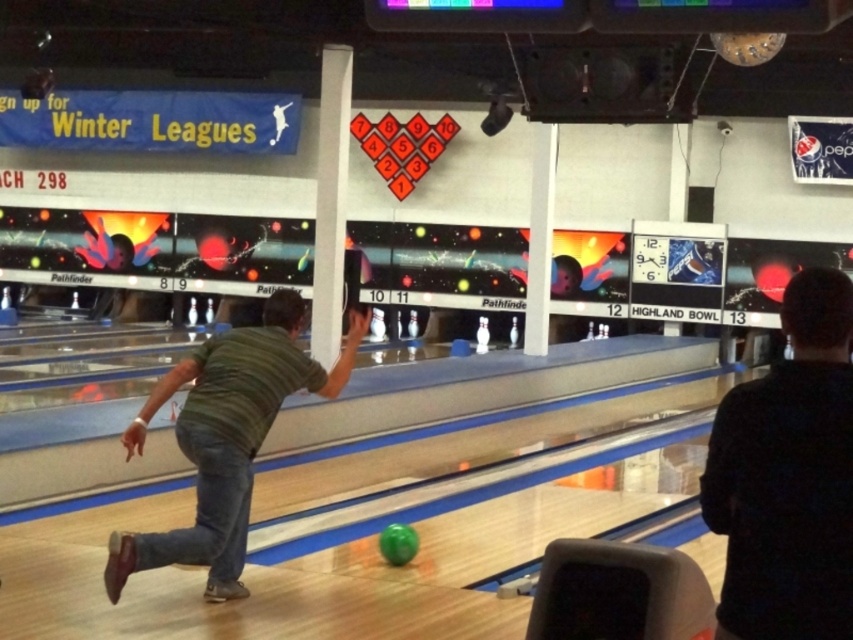
Question: Which point appears closest to the camera in this image?

Choices:
 (A) (224, 417)
 (B) (815, 369)

Answer: (B)

Question: Which point appears closest to the camera in this image?

Choices:
 (A) (291, 298)
 (B) (782, 486)

Answer: (B)

Question: Which point is farther to the camera?

Choices:
 (A) [x=213, y=358]
 (B) [x=732, y=596]

Answer: (A)

Question: Does dark green shirt at center appear under green striped shirt at center?

Choices:
 (A) yes
 (B) no

Answer: (B)

Question: Can you confirm if dark green shirt at center is positioned below green striped shirt at center?

Choices:
 (A) yes
 (B) no

Answer: (B)

Question: Does dark green shirt at center have a smaller size compared to green striped shirt at center?

Choices:
 (A) no
 (B) yes

Answer: (B)